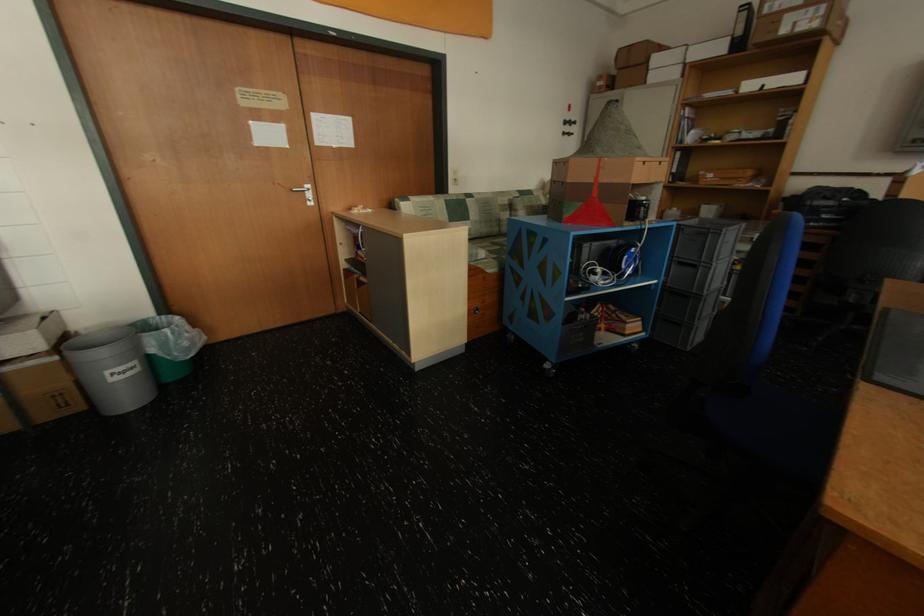
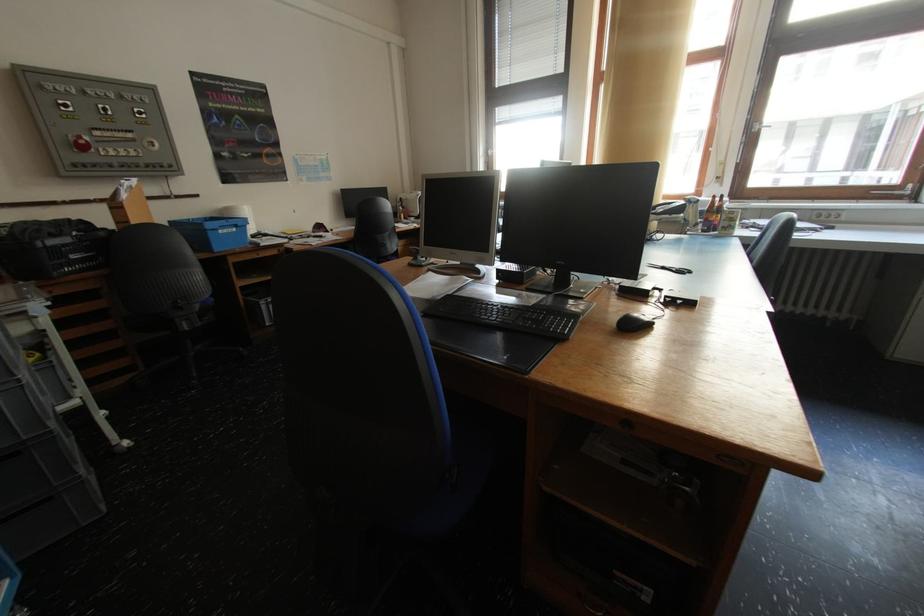
How did the camera likely rotate?

The camera rotated toward right-down.